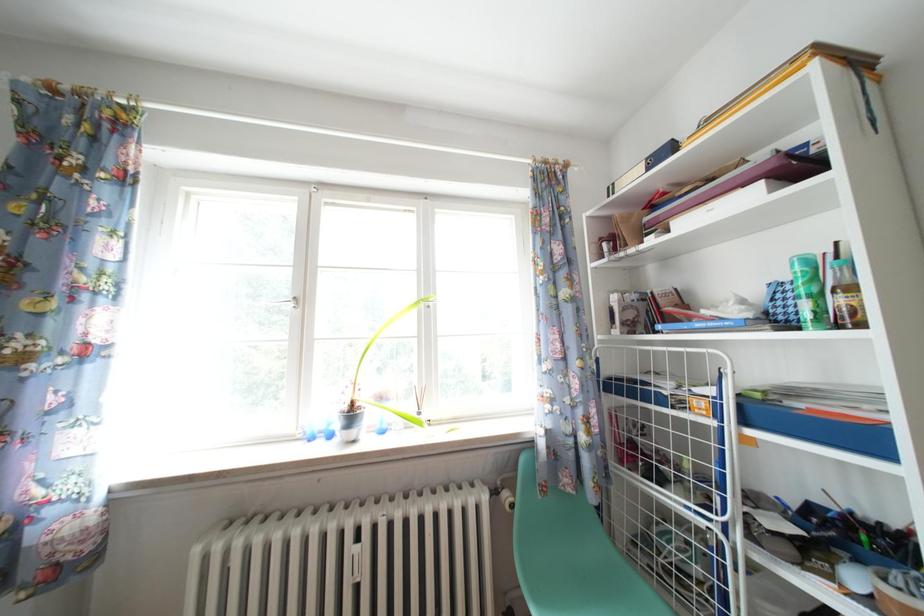
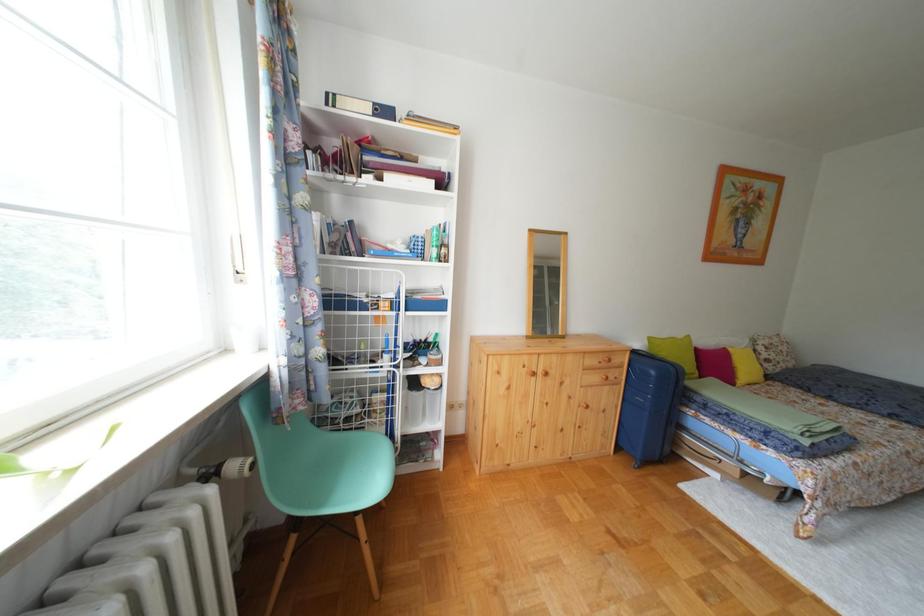
Question: The images are taken continuously from a first-person perspective. In which direction is your viewpoint rotating?

Choices:
 (A) Left
 (B) Right
 (C) Up
 (D) Down

Answer: (B)